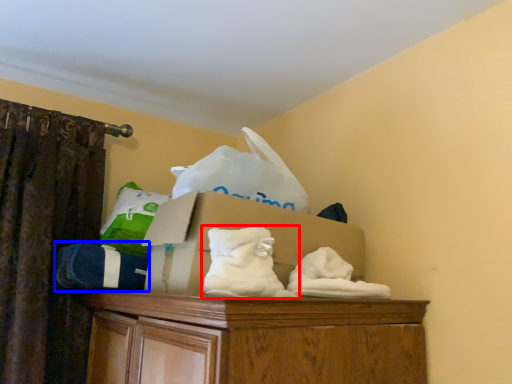
Question: Which point is further to the camera, sheet (highlighted by a red box) or clothing (highlighted by a blue box)?

Choices:
 (A) sheet
 (B) clothing

Answer: (B)